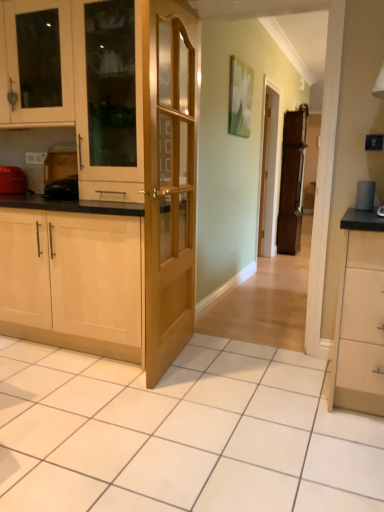
Question: From the image's perspective, does light wood/glass door at center appear lower than matte wooden screen door at center?

Choices:
 (A) yes
 (B) no

Answer: (A)

Question: From a real-world perspective, is light wood/glass door at center physically below matte wooden screen door at center?

Choices:
 (A) no
 (B) yes

Answer: (B)

Question: Is light wood/glass door at center smaller than matte wooden screen door at center?

Choices:
 (A) no
 (B) yes

Answer: (B)

Question: Can you confirm if light wood/glass door at center is bigger than matte wooden screen door at center?

Choices:
 (A) yes
 (B) no

Answer: (B)

Question: Is light wood/glass door at center wider than matte wooden screen door at center?

Choices:
 (A) no
 (B) yes

Answer: (A)

Question: In the image, is matte wood cabinet at center, marked as the 2th cabinetry in a top-to-bottom arrangement, positioned in front of or behind white glossy cabinet at upper left, marked as the first cabinetry in a top-to-bottom arrangement?

Choices:
 (A) behind
 (B) front

Answer: (B)

Question: From a real-world perspective, relative to white glossy cabinet at upper left, marked as the first cabinetry in a top-to-bottom arrangement, is matte wood cabinet at center, which is the 2th cabinetry from bottom to top, vertically above or below?

Choices:
 (A) below
 (B) above

Answer: (A)

Question: Considering the positions of matte wood cabinet at center, which is the 2th cabinetry from bottom to top, and white glossy cabinet at upper left, which is the third cabinetry from bottom to top, in the image, is matte wood cabinet at center, which is the 2th cabinetry from bottom to top, wider or thinner than white glossy cabinet at upper left, which is the third cabinetry from bottom to top,?

Choices:
 (A) thin
 (B) wide

Answer: (A)

Question: Looking at the image, does matte wood cabinet at center, marked as the 2th cabinetry in a top-to-bottom arrangement, seem bigger or smaller compared to white glossy cabinet at upper left, marked as the first cabinetry in a top-to-bottom arrangement?

Choices:
 (A) small
 (B) big

Answer: (A)

Question: From their relative heights in the image, would you say white glossy cabinet at upper left, marked as the first cabinetry in a top-to-bottom arrangement, is taller or shorter than matte wooden screen door at center?

Choices:
 (A) tall
 (B) short

Answer: (B)

Question: From a real-world perspective, is white glossy cabinet at upper left, which is the third cabinetry from bottom to top, physically located above or below matte wooden screen door at center?

Choices:
 (A) below
 (B) above

Answer: (B)

Question: Choose the correct answer: Is white glossy cabinet at upper left, which is the third cabinetry from bottom to top, inside matte wooden screen door at center or outside it?

Choices:
 (A) inside
 (B) outside

Answer: (B)

Question: Based on their sizes in the image, would you say white glossy cabinet at upper left, which is the third cabinetry from bottom to top, is bigger or smaller than matte wooden screen door at center?

Choices:
 (A) big
 (B) small

Answer: (B)

Question: From the image's perspective, is white glossy cabinet at upper left, which is the third cabinetry from bottom to top, located above or below brown wooden fridge at center?

Choices:
 (A) below
 (B) above

Answer: (B)

Question: From their relative heights in the image, would you say white glossy cabinet at upper left, which is the third cabinetry from bottom to top, is taller or shorter than brown wooden fridge at center?

Choices:
 (A) tall
 (B) short

Answer: (B)